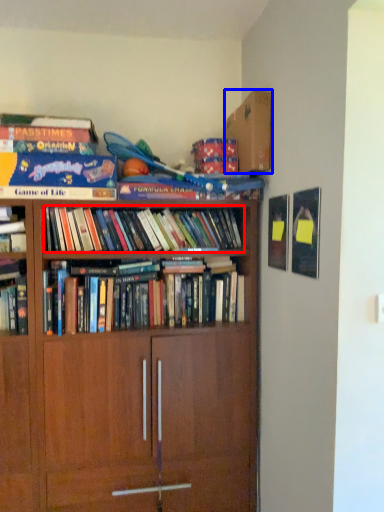
Question: Which of the following is the farthest to the observer, book (highlighted by a red box) or cardboard box (highlighted by a blue box)?

Choices:
 (A) book
 (B) cardboard box

Answer: (B)